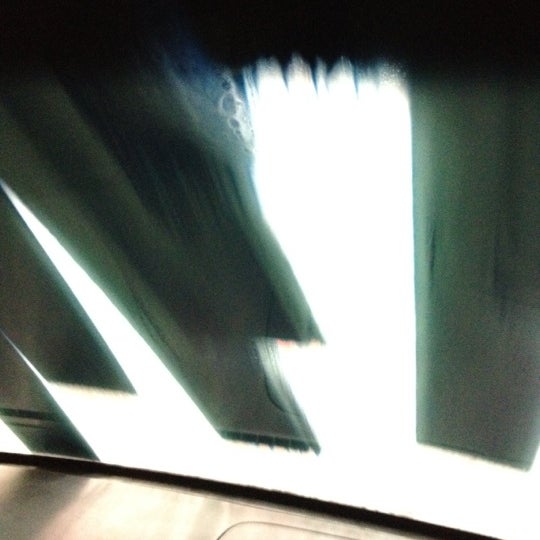
Locate an element on the screen. The width and height of the screenshot is (540, 540). baseboard is located at coordinates (125, 472).